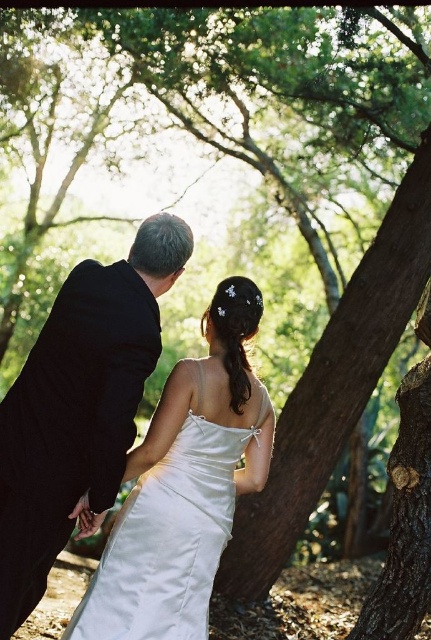
Question: Can you confirm if black satin suit at left is thinner than satin dress at center?

Choices:
 (A) yes
 (B) no

Answer: (A)

Question: Among these objects, which one is farthest from the camera?

Choices:
 (A) black satin suit at left
 (B) satin dress at center

Answer: (B)

Question: Is the position of black satin suit at left more distant than that of satin dress at center?

Choices:
 (A) no
 (B) yes

Answer: (A)

Question: Is black satin suit at left closer to camera compared to satin dress at center?

Choices:
 (A) no
 (B) yes

Answer: (B)